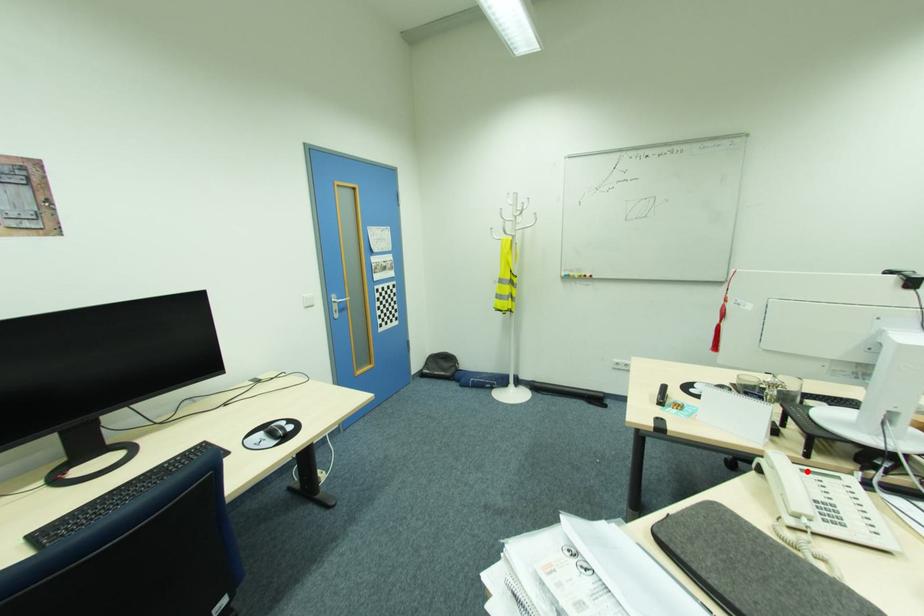
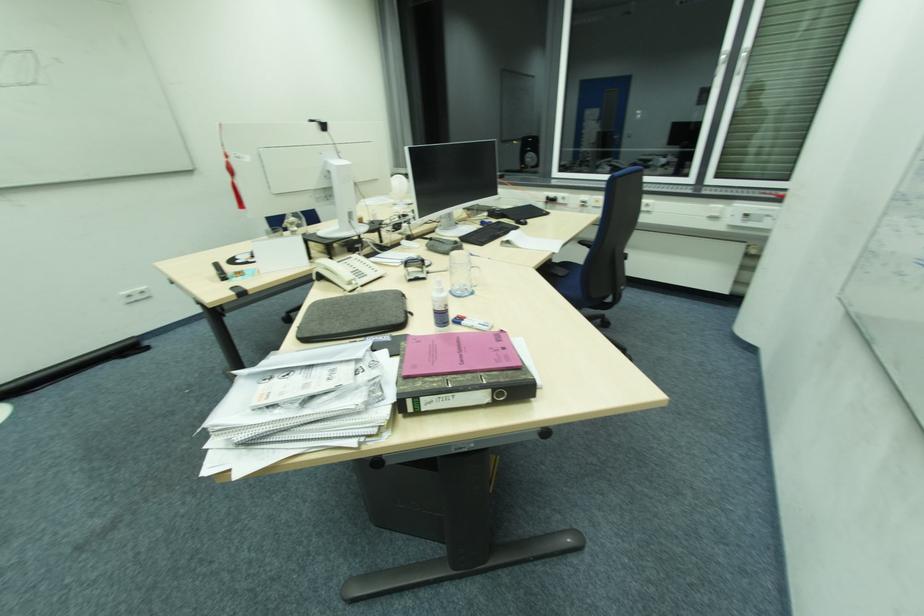
Question: I am providing you with two images of the same scene from different viewpoints. A red point is marked on the first image. Is the red point's position out of view in image 2?

Choices:
 (A) Yes
 (B) No

Answer: (B)